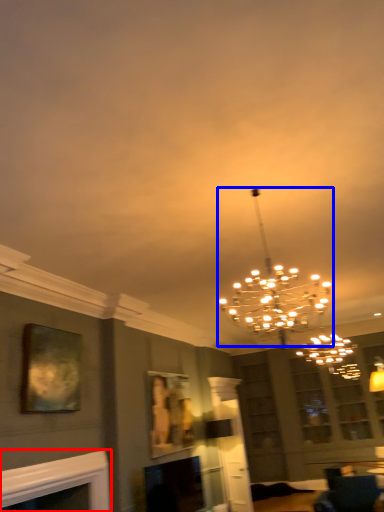
Question: Which point is further to the camera, fireplace (highlighted by a red box) or lamp (highlighted by a blue box)?

Choices:
 (A) fireplace
 (B) lamp

Answer: (A)